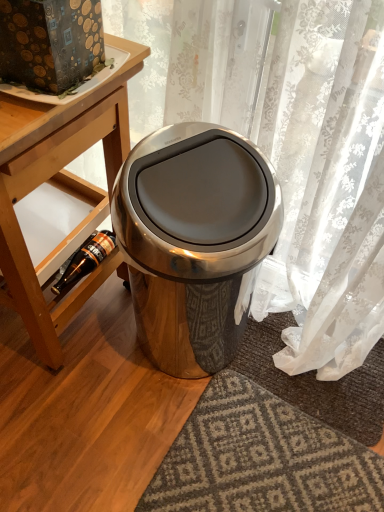
This screenshot has height=512, width=384. I want to click on vacant space in front of satin metallic trash can at center, so click(x=165, y=445).